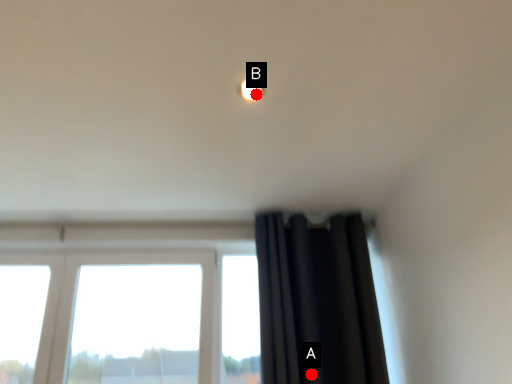
Question: Two points are circled on the image, labeled by A and B beside each circle. Which point is further to the camera?

Choices:
 (A) A is further
 (B) B is further

Answer: (A)